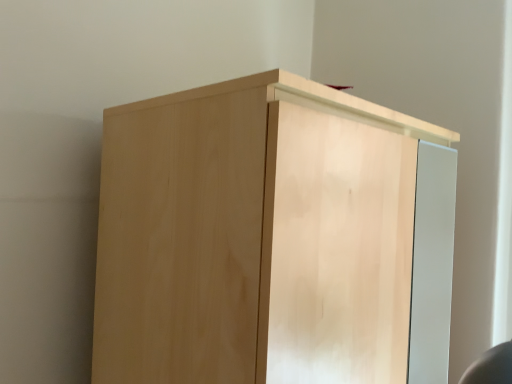
Measure the distance between natural wood cupboard at center and camera.

natural wood cupboard at center and camera are 26.97 inches apart.

Identify the location of natural wood cupboard at center. pyautogui.click(x=272, y=238).

The image size is (512, 384). Describe the element at coordinates (272, 238) in the screenshot. I see `natural wood cupboard at center` at that location.

Where is `natural wood cupboard at center`? This screenshot has width=512, height=384. natural wood cupboard at center is located at coordinates (272, 238).